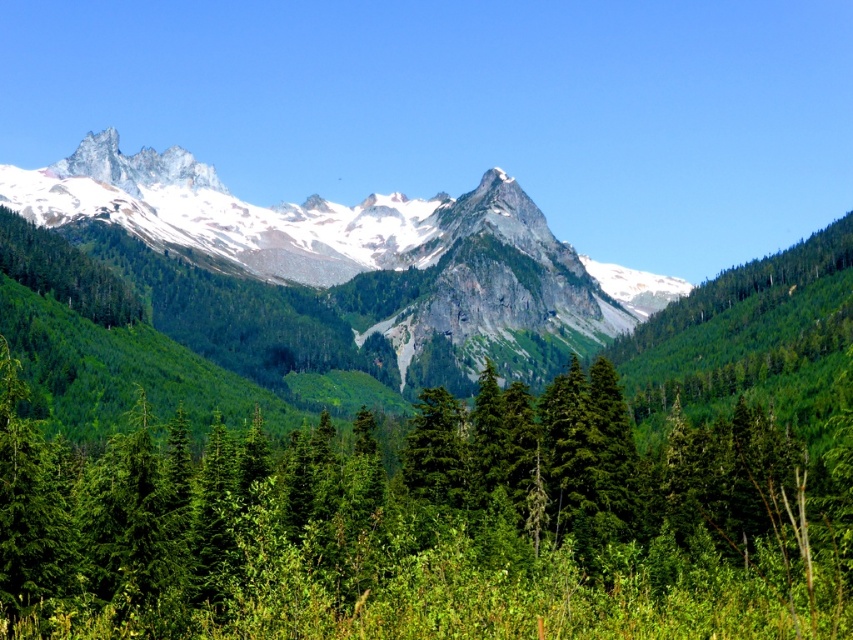
You are planning to set up a tent for camping. You have a tent that requires a space wider than the green matte tree at center. Can you safely place your tent next to the snowy granite peak at upper left?

The green matte tree at center might be wider than the snowy granite peak at upper left, so it is uncertain if the tent will fit. Check the width of the snowy granite peak at upper left first before deciding.

You are standing at the origin point in the image, which is the bottom left corner. You want to reach the green matte tree at center. In which direction should you move to get there?

To reach the green matte tree at center located at point 0.822 on the x axis and 0.502 on the y axis, you should move to the right and slightly upwards from your current position at the origin.

You are an environmental researcher observing the landscape. You need to determine which object occupies more visual space in the image. Based on the scene, which one is bigger between the green matte tree at center and the snowy granite peak at upper left?

The green matte tree at center has a larger size compared to the snowy granite peak at upper left, so it occupies more visual space in the image.